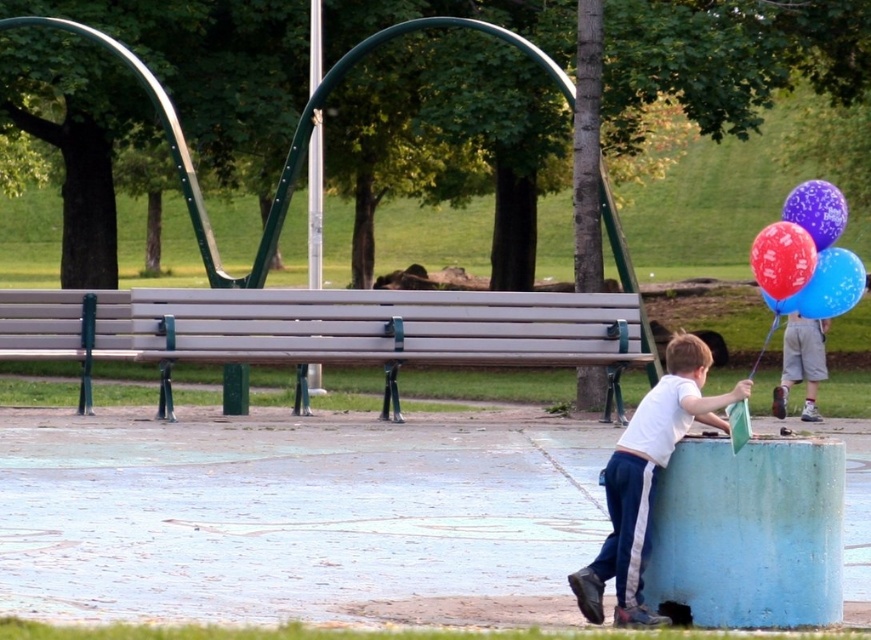
You are standing in the park and want to place a new bench exactly at the point marked by the coordinates point (589, 316). The current bench is located at the wooden bench with green metal supports. How far apart will the two benches be?

The point (589, 316) is 20.70 meters from the viewer. Since the current bench is already at the wooden bench with green metal supports, the distance between the new bench at point (589, 316) and the existing bench would depend on their exact positions relative to the viewer. However, the provided information only specifies the distance of the new point from the viewer, not the existing bench. Without knowing the distance of the existing bench from the viewer, we cannot calculate the exact distance apart

You are a park visitor who wants to sit down. You see the wooden bench at center and the brushed metal pole at center. Which one is more suitable for sitting?

The wooden bench at center is more suitable for sitting because it is designed for seating, while the brushed metal pole at center is likely a structural support and not meant for sitting.

What is located at the coordinates point [389,332] in the park scene?

The wooden bench at center is located at point [389,332].